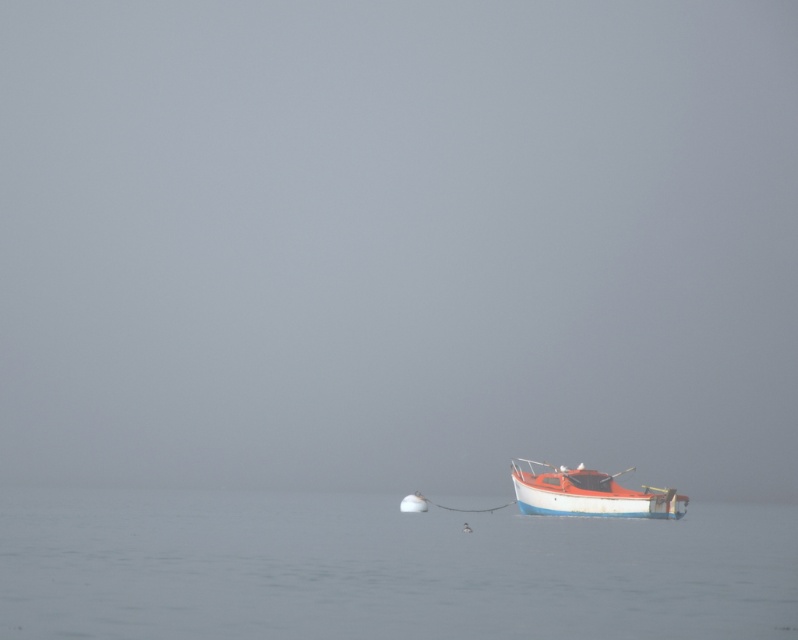
How far apart are matte white boat at lower right and white matte buoy at center?

8.60 meters

Is point (660, 506) behind point (425, 509)?

No.

Locate an element on the screen. The height and width of the screenshot is (640, 798). matte white boat at lower right is located at coordinates (x=589, y=493).

Image resolution: width=798 pixels, height=640 pixels. Identify the location of matte white boat at lower right. (589, 493).

Is smooth water at boat right positioned behind matte white boat at lower right?

That is False.

This screenshot has width=798, height=640. What are the coordinates of `smooth water at boat right` in the screenshot? It's located at (381, 568).

This screenshot has width=798, height=640. Describe the element at coordinates (381, 568) in the screenshot. I see `smooth water at boat right` at that location.

Consider the image. Does smooth water at boat right appear on the left side of white matte buoy at center?

Correct, you'll find smooth water at boat right to the left of white matte buoy at center.

Find the location of a particular element. This screenshot has height=640, width=798. smooth water at boat right is located at coordinates (381, 568).

Locate an element on the screen. The height and width of the screenshot is (640, 798). smooth water at boat right is located at coordinates (381, 568).